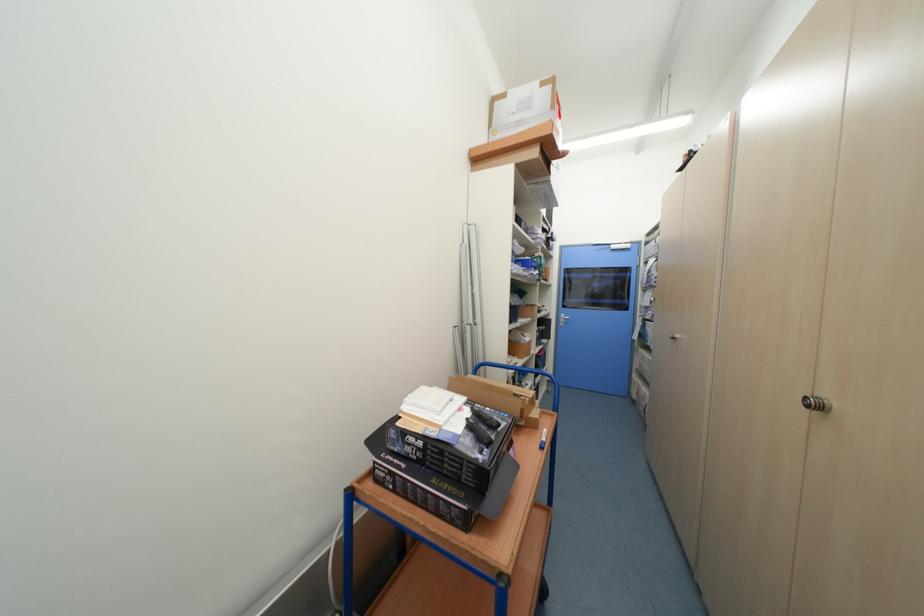
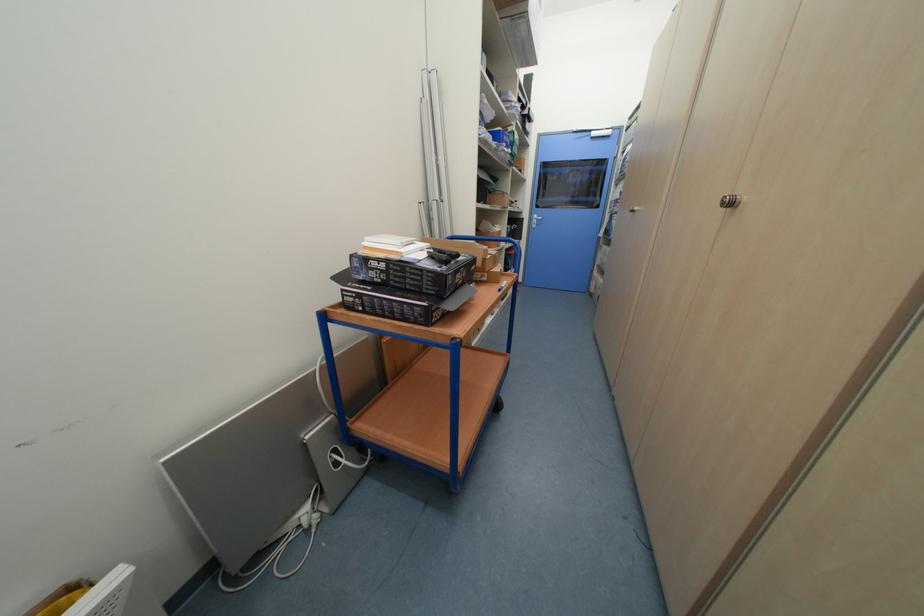
In the second image, find the point that corresponds to point (813, 408) in the first image.

(728, 206)